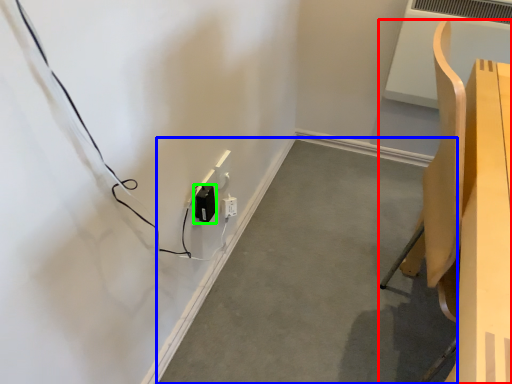
Question: Based on their relative distances, which object is farther from furniture (highlighted by a red box)? Choose from concrete (highlighted by a blue box) and electric outlet (highlighted by a green box).

Choices:
 (A) concrete
 (B) electric outlet

Answer: (B)